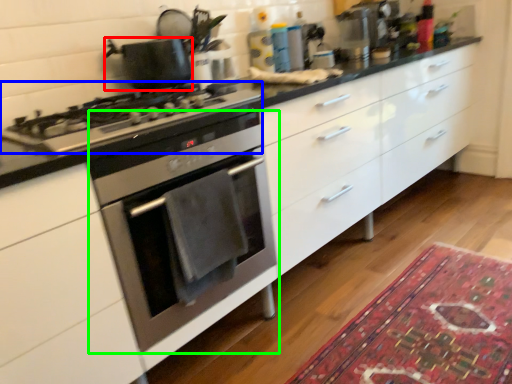
Question: Which is nearer to the kitchen appliance (highlighted by a red box)? gas stove (highlighted by a blue box) or oven (highlighted by a green box).

Choices:
 (A) gas stove
 (B) oven

Answer: (A)